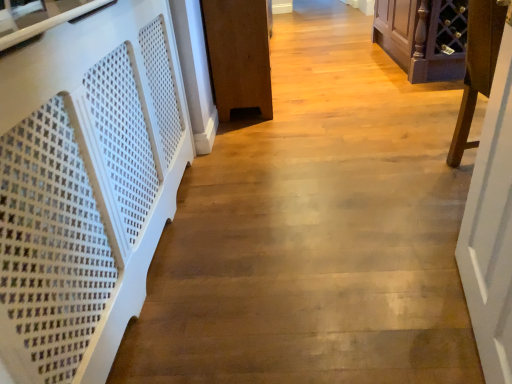
Identify the location of unoccupied region to the right of brown wood cabinet at center, which is the 1th furniture from left to right. The width and height of the screenshot is (512, 384). (361, 90).